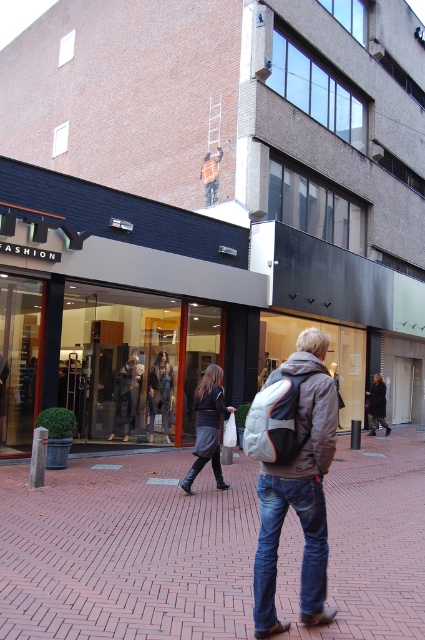
Between blue denim jeans at lower right and matte gray mannequin at center, which one appears on the right side from the viewer's perspective?

From the viewer's perspective, blue denim jeans at lower right appears more on the right side.

Where is `blue denim jeans at lower right`? Image resolution: width=425 pixels, height=640 pixels. blue denim jeans at lower right is located at coordinates (277, 545).

Can you confirm if denim jacket at center is shorter than dark gray wool coat at center?

No, denim jacket at center is not shorter than dark gray wool coat at center.

From the picture: Is the position of denim jacket at center less distant than that of dark gray wool coat at center?

Yes, it is in front of dark gray wool coat at center.

Where is `denim jacket at center`? This screenshot has width=425, height=640. denim jacket at center is located at coordinates (292, 476).

Is dark gray skirt at center to the right of matte gray mannequin at center from the viewer's perspective?

Indeed, dark gray skirt at center is positioned on the right side of matte gray mannequin at center.

Is dark gray skirt at center behind matte gray mannequin at center?

No, dark gray skirt at center is closer to the viewer.

Find the location of a particular element. The height and width of the screenshot is (640, 425). dark gray skirt at center is located at coordinates (207, 426).